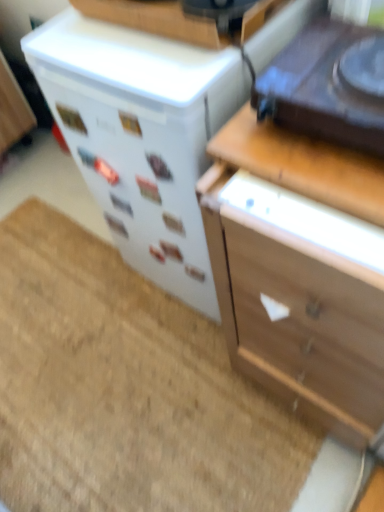
Question: From a real-world perspective, is shiny black turntable at upper right, which is the first appliance from front to back, above or below wooden at upper right?

Choices:
 (A) above
 (B) below

Answer: (A)

Question: Looking at their shapes, would you say shiny black turntable at upper right, which is the 2th appliance from back to front, is wider or thinner than wooden at upper right?

Choices:
 (A) wide
 (B) thin

Answer: (A)

Question: Which object is positioned closest to the wooden at upper right?

Choices:
 (A) white glossy refrigerator at center-left, which is the 2th appliance from front to back
 (B) wooden chest of drawers at right
 (C) beige carpet at lower left
 (D) shiny black turntable at upper right, which is the 2th appliance from back to front

Answer: (D)

Question: Which object is positioned farthest from the wooden at upper right?

Choices:
 (A) wooden chest of drawers at right
 (B) white glossy refrigerator at center-left, which ranks as the first appliance in back-to-front order
 (C) shiny black turntable at upper right, which is the first appliance from front to back
 (D) beige carpet at lower left

Answer: (D)